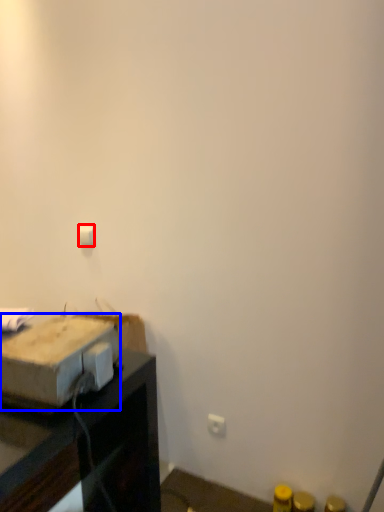
Question: Which object appears closest to the camera in this image, light switch (highlighted by a red box) or cardboard box (highlighted by a blue box)?

Choices:
 (A) light switch
 (B) cardboard box

Answer: (B)